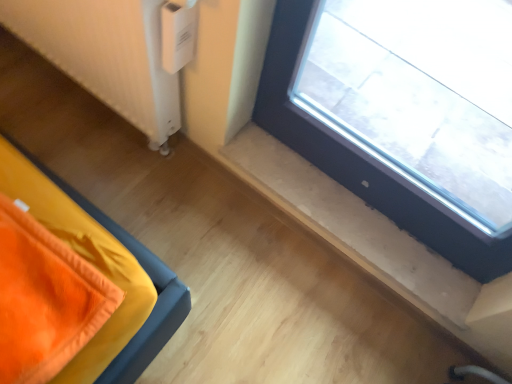
This screenshot has width=512, height=384. Find the location of `vacant region below white plastic radiator at lower left (from a real-world perspective)`. vacant region below white plastic radiator at lower left (from a real-world perspective) is located at coordinates (86, 98).